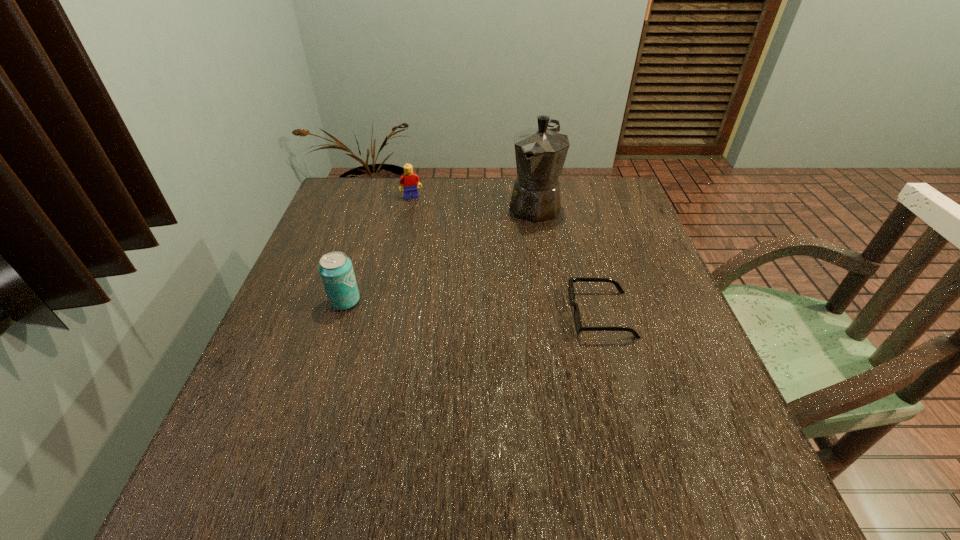
Find the location of a particular element. free space on the desktop that is between the beer can and the sunglasses and is positioned on the face of the Lego is located at coordinates click(x=453, y=306).

Image resolution: width=960 pixels, height=540 pixels. Identify the location of vacant spot on the desktop that is between the beer can and the sunglasses and is positioned on the pouring side of the tallest object. (465, 307).